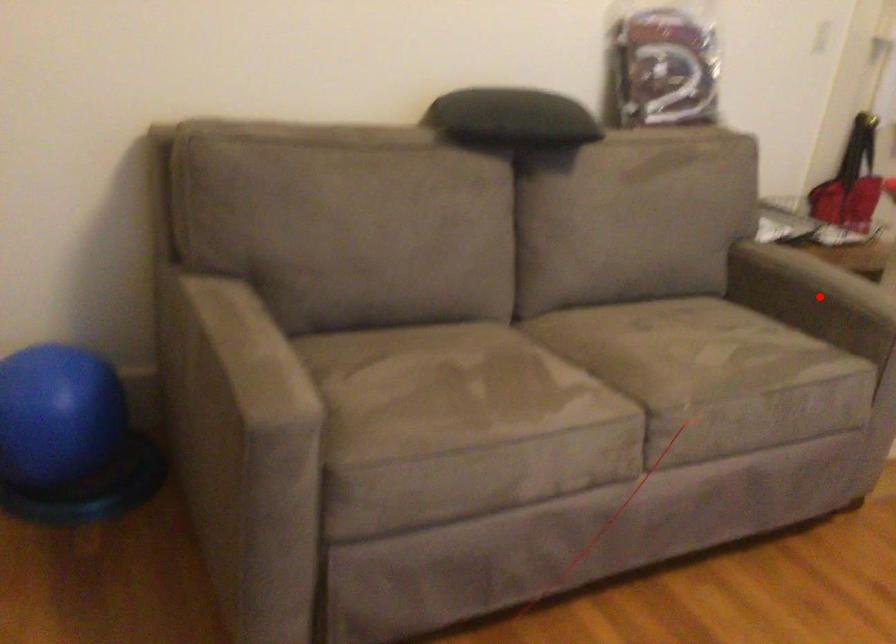
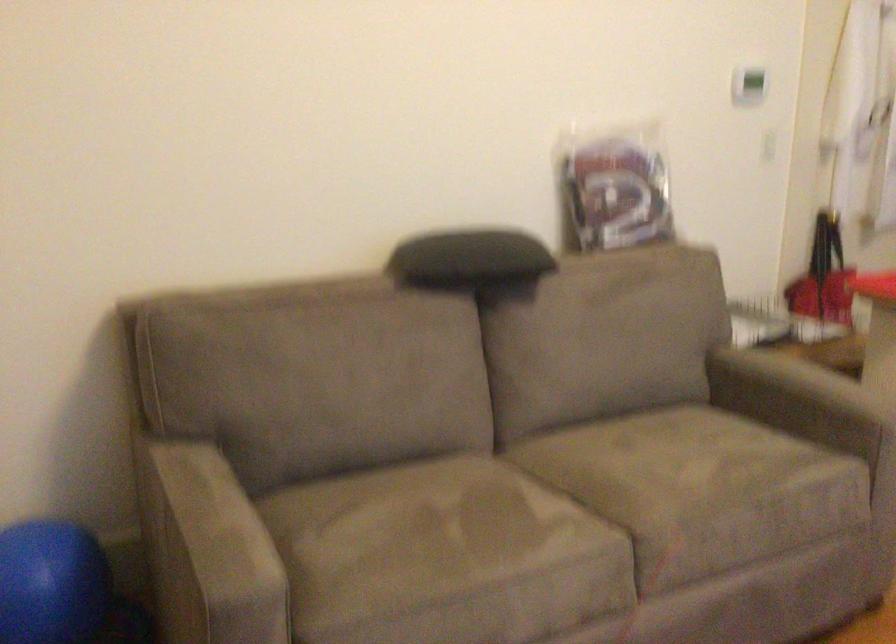
Where in the second image is the point corresponding to the highlighted location from the first image?

(798, 400)